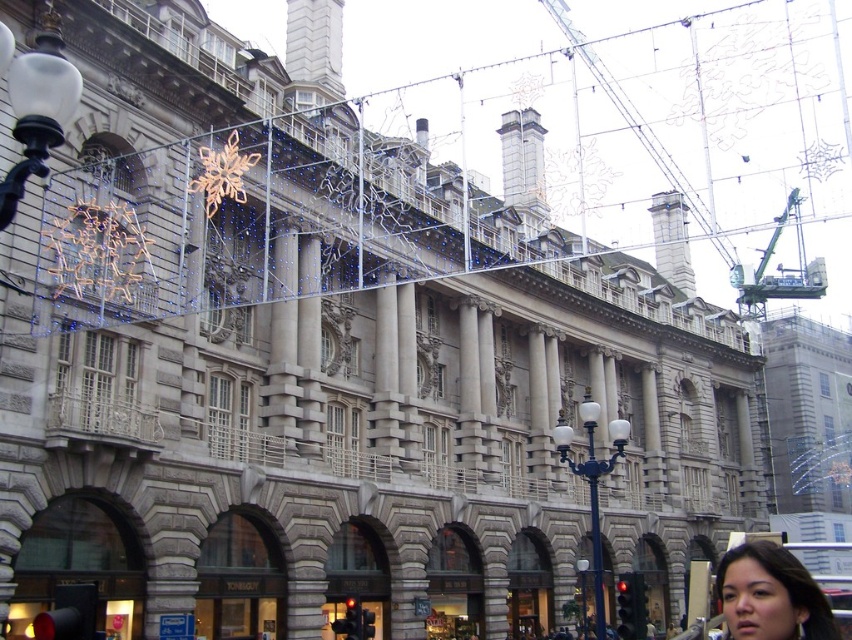
You are an architect evaluating the proportions of the building. Which object, the smooth skin face at lower right or the green metallic crane at upper right, takes up less horizontal space on the building facade?

The smooth skin face at lower right has a lesser width compared to the green metallic crane at upper right, so it takes up less horizontal space on the building facade.

Looking at this image, you are standing in front of the grand historic building and want to take a photo of the smooth skin face at lower right. If your camera has a maximum focus range of 100 feet, will you be able to capture the face clearly?

The smooth skin face at lower right and the camera are 101.80 feet apart, which exceeds the camera maximum focus range of 100 feet. Therefore, the face cannot be captured clearly.

You are a photographer standing 50 meters away from the green metallic crane at upper center and the smooth skin face at lower right. You want to take a photo that captures both objects in the frame. Given that your camera has a maximum zoom range of 200 meters, will you be able to fit both objects into a single photo?

The distance between the green metallic crane at upper center and the smooth skin face at lower right is 119.75 meters. Since your camera can zoom up to 200 meters, which is greater than the distance between the two objects, you can fit both into a single photo by adjusting the zoom appropriately.